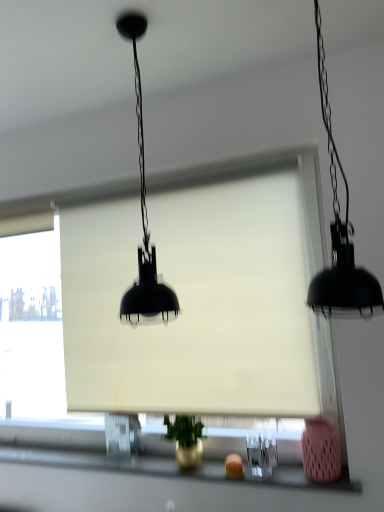
Question: Does matte black lampshade at center, marked as the 2th lamp in a right-to-left arrangement, turn towards black matte pendant light at right, which is the second lamp in left-to-right order?

Choices:
 (A) no
 (B) yes

Answer: (A)

Question: Would you say black matte pendant light at right, the 1th lamp viewed from the right, is part of matte black lampshade at center, the 1th lamp when ordered from left to right,'s contents?

Choices:
 (A) yes
 (B) no

Answer: (B)

Question: From the image's perspective, does matte black lampshade at center, the 1th lamp when ordered from left to right, appear lower than black matte pendant light at right, which is the second lamp in left-to-right order?

Choices:
 (A) yes
 (B) no

Answer: (A)

Question: Is black matte pendant light at right, the 1th lamp viewed from the right, at the back of matte black lampshade at center, marked as the 2th lamp in a right-to-left arrangement?

Choices:
 (A) yes
 (B) no

Answer: (B)

Question: From the image's perspective, is matte black lampshade at center, the 1th lamp when ordered from left to right, on black matte pendant light at right, which is the second lamp in left-to-right order?

Choices:
 (A) yes
 (B) no

Answer: (B)

Question: Does matte black lampshade at center, marked as the 2th lamp in a right-to-left arrangement, have a larger size compared to black matte pendant light at right, the 1th lamp viewed from the right?

Choices:
 (A) yes
 (B) no

Answer: (B)

Question: Is matte black lampshade at center, the 1th lamp when ordered from left to right, oriented towards metallic gold vase at lower center?

Choices:
 (A) no
 (B) yes

Answer: (A)

Question: Does matte black lampshade at center, marked as the 2th lamp in a right-to-left arrangement, have a smaller size compared to metallic gold vase at lower center?

Choices:
 (A) no
 (B) yes

Answer: (A)

Question: Considering the relative sizes of matte black lampshade at center, marked as the 2th lamp in a right-to-left arrangement, and metallic gold vase at lower center in the image provided, is matte black lampshade at center, marked as the 2th lamp in a right-to-left arrangement, taller than metallic gold vase at lower center?

Choices:
 (A) no
 (B) yes

Answer: (B)

Question: Is the position of matte black lampshade at center, the 1th lamp when ordered from left to right, more distant than that of metallic gold vase at lower center?

Choices:
 (A) yes
 (B) no

Answer: (B)

Question: Is matte black lampshade at center, the 1th lamp when ordered from left to right, thinner than metallic gold vase at lower center?

Choices:
 (A) yes
 (B) no

Answer: (B)

Question: From a real-world perspective, is matte black lampshade at center, the 1th lamp when ordered from left to right, positioned over metallic gold vase at lower center based on gravity?

Choices:
 (A) yes
 (B) no

Answer: (A)

Question: Does white matte window screen at center touch metallic gold vase at lower center?

Choices:
 (A) no
 (B) yes

Answer: (A)